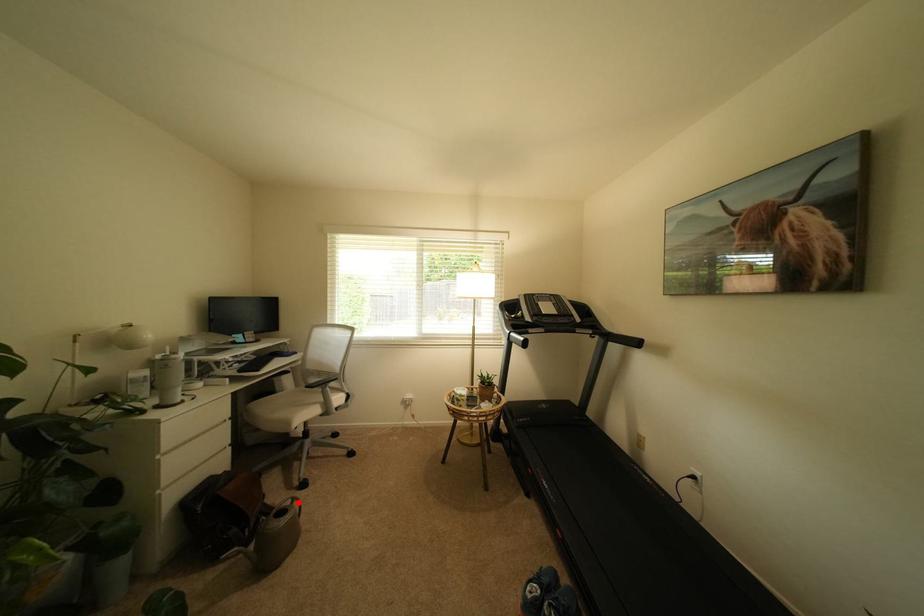
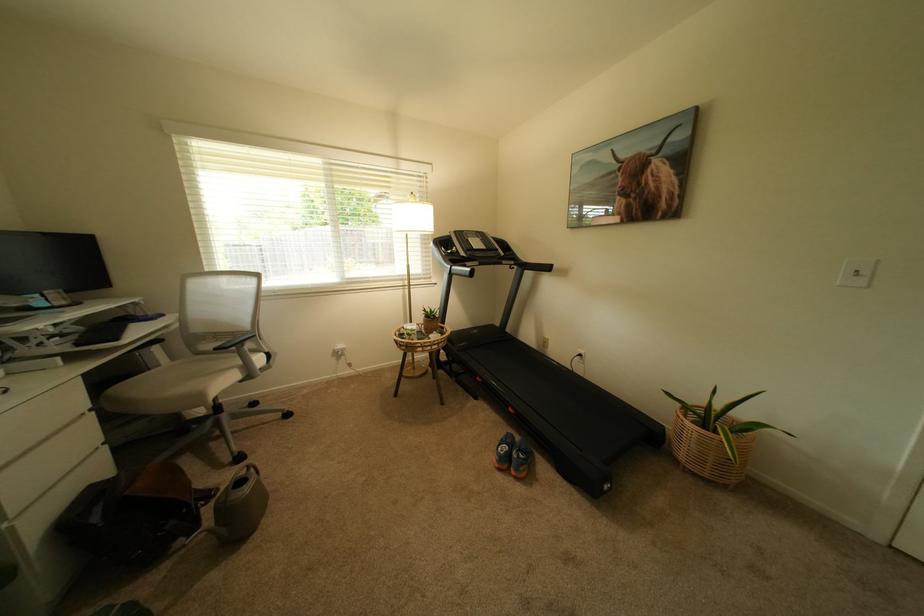
The point at the highlighted location is marked in the first image. Where is the corresponding point in the second image?

(253, 471)